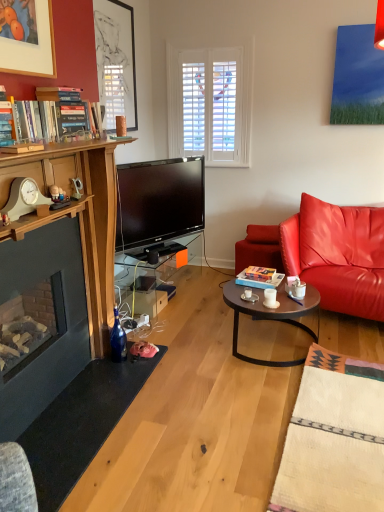
Find the location of `vacant area on top of wooden round table at center (from a real-world perspective)`. vacant area on top of wooden round table at center (from a real-world perspective) is located at coordinates (278, 290).